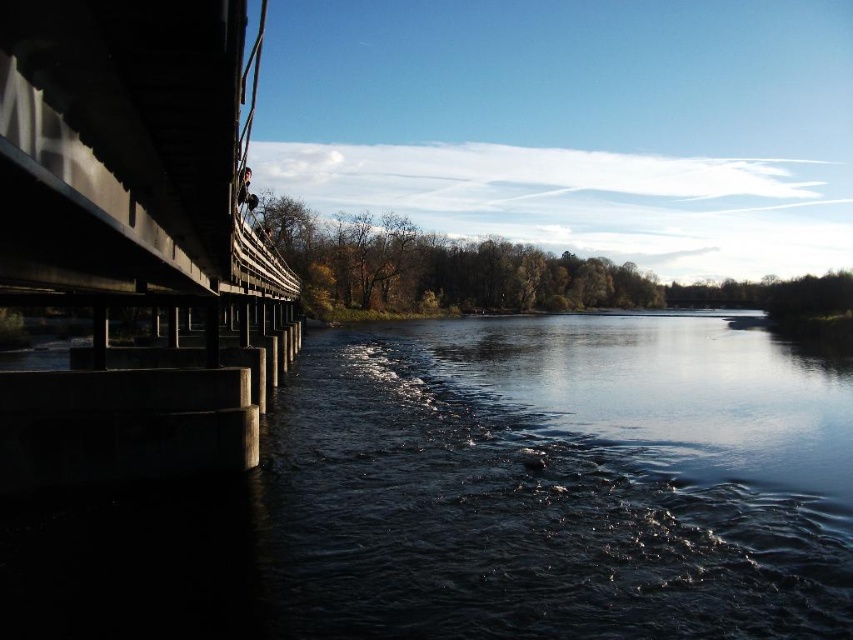
You are standing at the point labeled as point (718, 573) in the riverside scene. If you want to throw a stone to reach the bridge on the left side, which is 9.12 meters away from you, what is the minimum distance you need to throw the stone?

The minimum distance you need to throw the stone is 9.12 meters, as the point labeled point (718, 573) is exactly 9.12 meters away from the viewer.

You are a photographer planning to capture the riverside scene. You want to ensure both the dark concrete water at lower left and the concrete bridge at left are visible in your shot. Based on their spatial relationship, which object will occupy more of the frame?

The concrete bridge at left occupies more space in the frame than the dark concrete water at lower left, as the dark concrete water at lower left occupies less space than concrete bridge at left.

You are standing at the riverside and want to cross to the bridge on the left. The dark concrete water at lower left is 7.75 meters from viewer. Can you safely step onto the bridge from your current position?

The dark concrete water at lower left is 7.75 meters from viewer, so you can safely step onto the bridge from your current position as the distance is manageable.